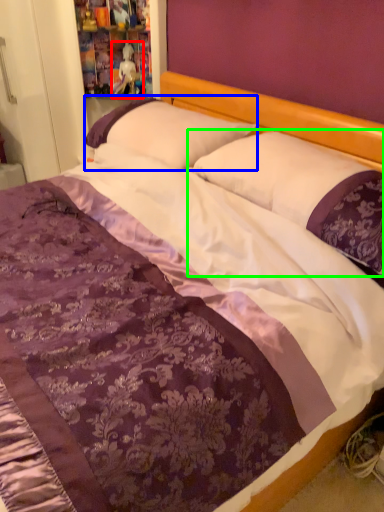
Question: Estimate the real-world distances between objects in this image. Which object is farther from doll (highlighted by a red box), pillow (highlighted by a blue box) or pillow (highlighted by a green box)?

Choices:
 (A) pillow
 (B) pillow

Answer: (B)